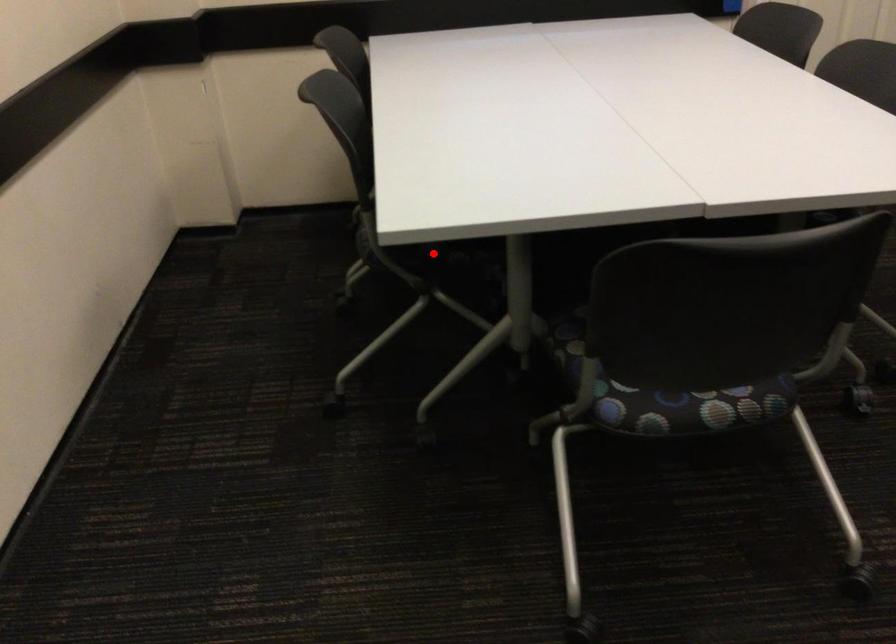
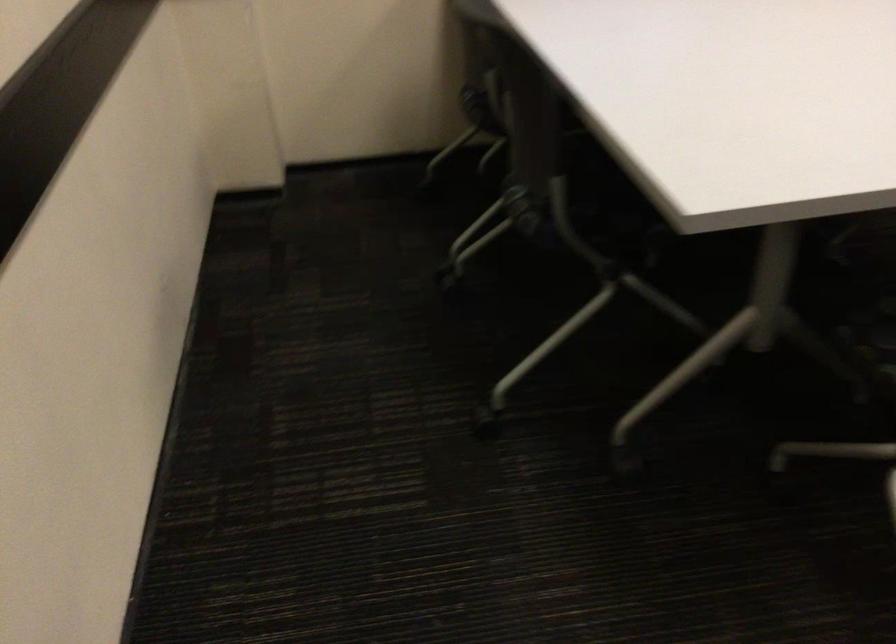
Find the pixel in the second image that matches the highlighted location in the first image.

(619, 227)